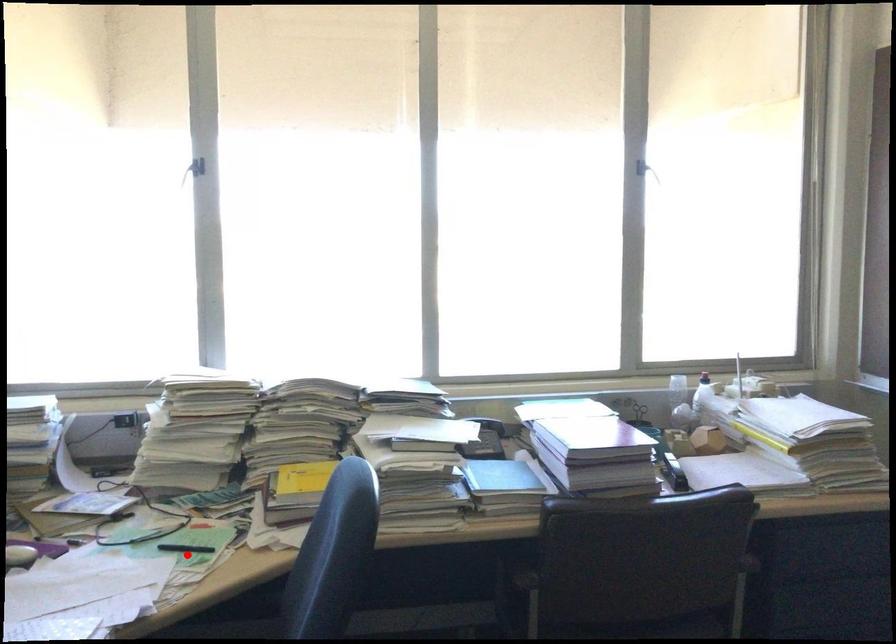
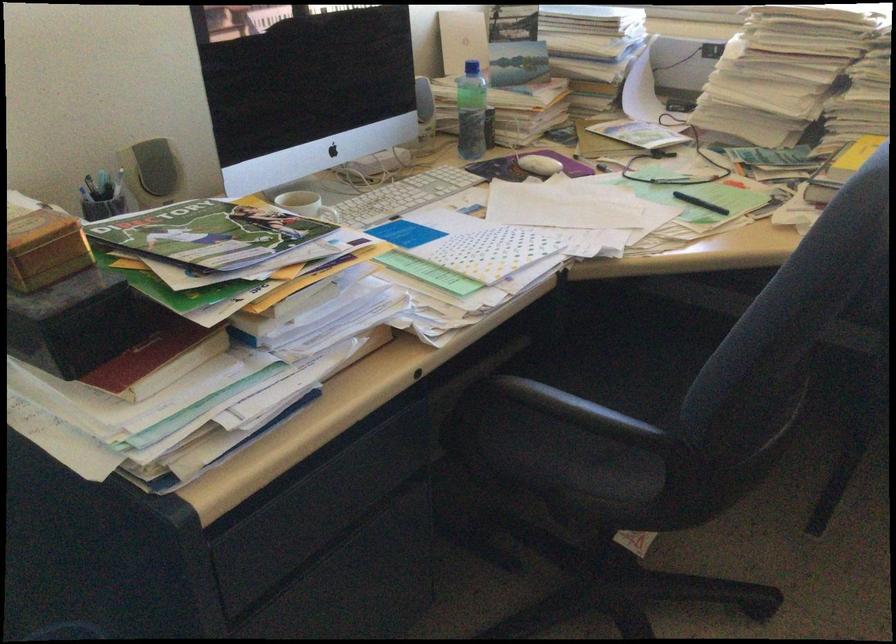
Question: A red point is marked in image1. In image2, is the corresponding 3D point closer to the camera or farther? Reply with the corresponding letter.

Choices:
 (A) The corresponding 3D point is closer.
 (B) The corresponding 3D point is farther.

Answer: (A)